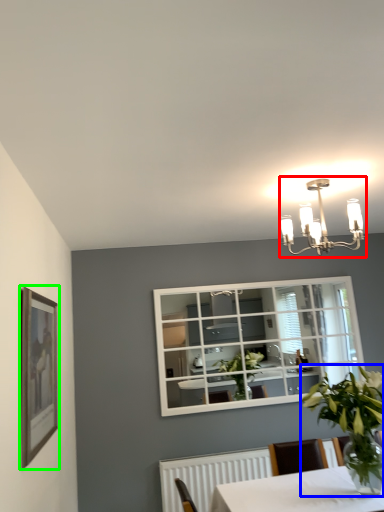
Question: Estimate the real-world distances between objects in this image. Which object is closer to lamp (highlighted by a red box), houseplant (highlighted by a blue box) or picture frame (highlighted by a green box)?

Choices:
 (A) houseplant
 (B) picture frame

Answer: (A)